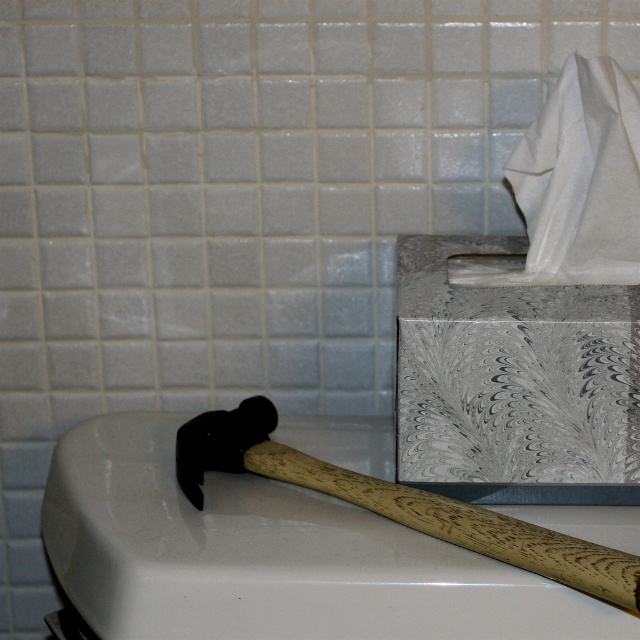
Question: Among these points, which one is nearest to the camera?

Choices:
 (A) (452, 529)
 (B) (554, 308)

Answer: (A)

Question: Which object appears closest to the camera in this image?

Choices:
 (A) wooden textured hammer at lower left
 (B) white marbled tissue at upper right

Answer: (A)

Question: Can you confirm if white marbled tissue at upper right is positioned below wooden textured hammer at lower left?

Choices:
 (A) yes
 (B) no

Answer: (B)

Question: Among these objects, which one is farthest from the camera?

Choices:
 (A) wooden textured hammer at lower left
 (B) white marbled tissue at upper right

Answer: (B)

Question: Is white marbled tissue at upper right behind wooden textured hammer at lower left?

Choices:
 (A) yes
 (B) no

Answer: (A)

Question: Does white marbled tissue at upper right have a lesser width compared to wooden textured hammer at lower left?

Choices:
 (A) no
 (B) yes

Answer: (B)